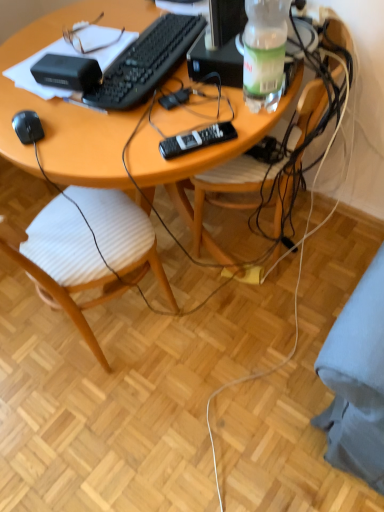
Question: Is wooden chair at center, which is counted as the second chair, starting from the right, to the left of wooden desk at center from the viewer's perspective?

Choices:
 (A) no
 (B) yes

Answer: (B)

Question: Is wooden chair at center, which is counted as the second chair, starting from the right, shorter than wooden desk at center?

Choices:
 (A) no
 (B) yes

Answer: (A)

Question: Does wooden chair at center, which is counted as the second chair, starting from the right, appear on the right side of wooden desk at center?

Choices:
 (A) no
 (B) yes

Answer: (A)

Question: From the image's perspective, does wooden chair at center, marked as the first chair in a left-to-right arrangement, appear lower than wooden desk at center?

Choices:
 (A) yes
 (B) no

Answer: (A)

Question: Can you confirm if wooden chair at center, which is counted as the second chair, starting from the right, is thinner than wooden desk at center?

Choices:
 (A) no
 (B) yes

Answer: (B)

Question: Is wooden chair at center, marked as the 2th chair in a left-to-right arrangement, taller or shorter than black plastic remote at center?

Choices:
 (A) short
 (B) tall

Answer: (B)

Question: From a real-world perspective, relative to black plastic remote at center, is wooden chair at center, the first chair from the right, vertically above or below?

Choices:
 (A) below
 (B) above

Answer: (A)

Question: Considering the positions of wooden chair at center, the first chair from the right, and black plastic remote at center in the image, is wooden chair at center, the first chair from the right, bigger or smaller than black plastic remote at center?

Choices:
 (A) big
 (B) small

Answer: (A)

Question: Looking at their shapes, would you say wooden chair at center, marked as the 2th chair in a left-to-right arrangement, is wider or thinner than black plastic remote at center?

Choices:
 (A) wide
 (B) thin

Answer: (A)

Question: Would you say clear plastic bottle at upper right is to the left or to the right of wooden desk at center in the picture?

Choices:
 (A) right
 (B) left

Answer: (A)

Question: Looking at their shapes, would you say clear plastic bottle at upper right is wider or thinner than wooden desk at center?

Choices:
 (A) wide
 (B) thin

Answer: (B)

Question: Looking at the image, does clear plastic bottle at upper right seem bigger or smaller compared to wooden desk at center?

Choices:
 (A) big
 (B) small

Answer: (B)

Question: From their relative heights in the image, would you say clear plastic bottle at upper right is taller or shorter than wooden desk at center?

Choices:
 (A) tall
 (B) short

Answer: (B)

Question: From a real-world perspective, is wooden desk at center physically located above or below black matte computer mouse at lower left?

Choices:
 (A) above
 (B) below

Answer: (B)

Question: From their relative heights in the image, would you say wooden desk at center is taller or shorter than black matte computer mouse at lower left?

Choices:
 (A) tall
 (B) short

Answer: (A)